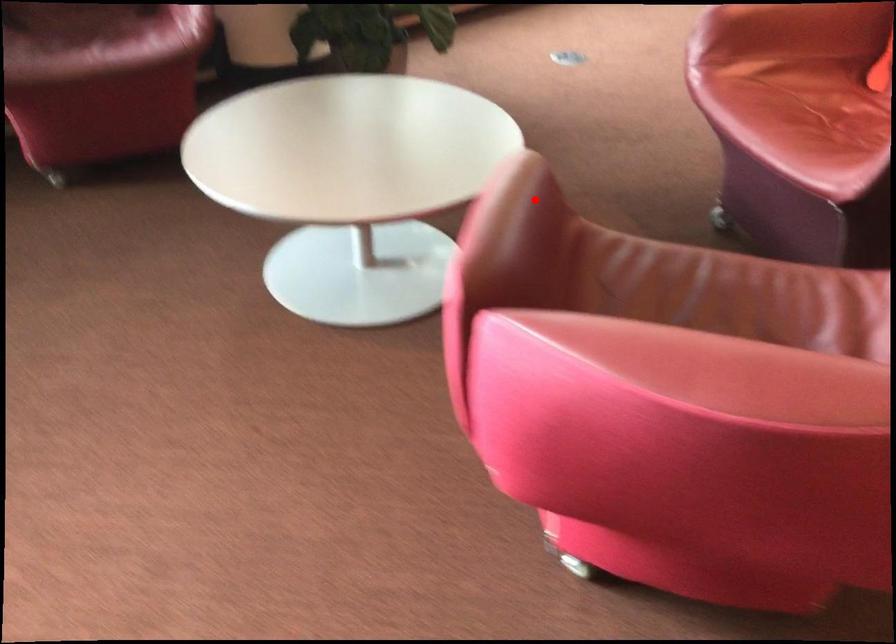
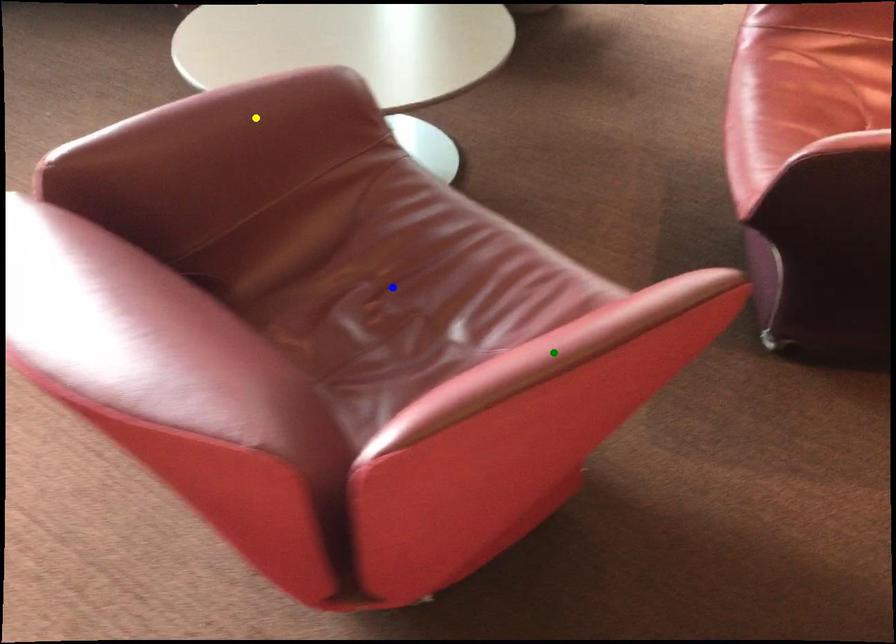
Question: I am providing you with two images of the same scene from different viewpoints. A red point is marked on the first image. You are given multiple points on the second image. Which point in image 2 represents the same 3d spot as the red point in image 1?

Choices:
 (A) yellow point
 (B) blue point
 (C) green point

Answer: (A)